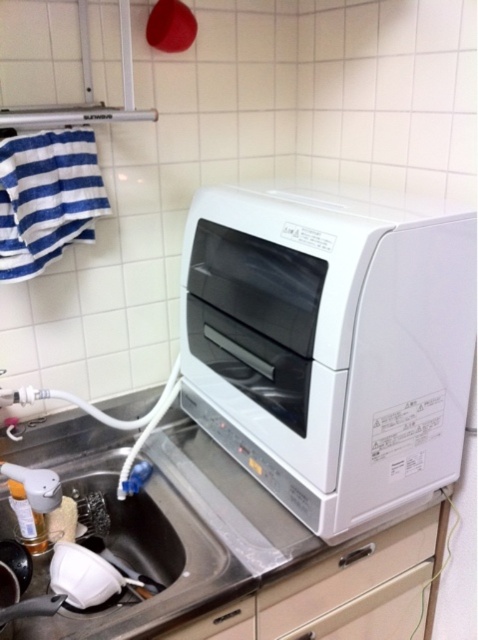
Question: Is white glossy countertop at upper center thinner than white plastic drawer at center?

Choices:
 (A) yes
 (B) no

Answer: (B)

Question: Is the position of white glossy countertop at upper center less distant than that of white plastic drawer at center?

Choices:
 (A) yes
 (B) no

Answer: (A)

Question: Among these objects, which one is farthest from the camera?

Choices:
 (A) matte white drawer at lower center
 (B) white glossy microwave at center
 (C) stainless steel sink at lower left
 (D) white plastic drawer at center

Answer: (D)

Question: Among these objects, which one is nearest to the camera?

Choices:
 (A) stainless steel sink at lower left
 (B) matte white drawer at lower center
 (C) white glossy microwave at center
 (D) white plastic drawer at center

Answer: (C)

Question: Can you confirm if stainless steel sink at lower left is bigger than white plastic drawer at center?

Choices:
 (A) yes
 (B) no

Answer: (A)

Question: Which of the following is the farthest from the observer?

Choices:
 (A) (421, 493)
 (B) (94, 458)

Answer: (B)